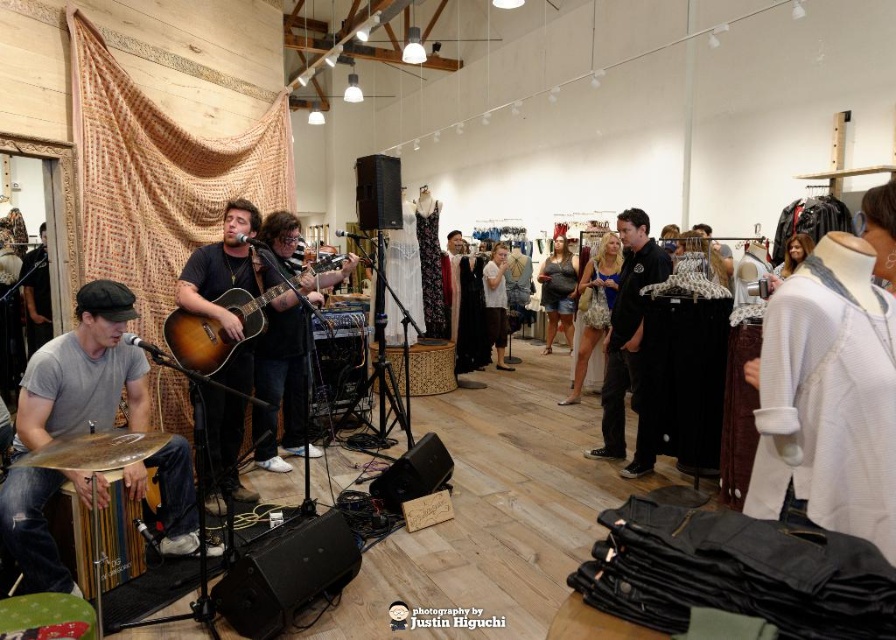
Which is above, satin brown guitar at center or matte gray tank top at center?

matte gray tank top at center is above.

Can you confirm if satin brown guitar at center is smaller than matte gray tank top at center?

Indeed, satin brown guitar at center has a smaller size compared to matte gray tank top at center.

What do you see at coordinates (225, 268) in the screenshot?
I see `satin brown guitar at center` at bounding box center [225, 268].

In order to click on satin brown guitar at center in this screenshot , I will do `click(225, 268)`.

Between sunburst wood acoustic guitar at center and matte gray tank top at center, which one has less height?

sunburst wood acoustic guitar at center is shorter.

Which is below, sunburst wood acoustic guitar at center or matte gray tank top at center?

sunburst wood acoustic guitar at center

This screenshot has width=896, height=640. I want to click on sunburst wood acoustic guitar at center, so click(x=214, y=330).

Is gray matte t-shirt at left thinner than satin brown guitar at center?

In fact, gray matte t-shirt at left might be wider than satin brown guitar at center.

At what (x,y) coordinates should I click in order to perform the action: click on gray matte t-shirt at left. Please return your answer as a coordinate pair (x, y). This screenshot has width=896, height=640. Looking at the image, I should click on (84, 372).

What are the coordinates of `gray matte t-shirt at left` in the screenshot? It's located at click(x=84, y=372).